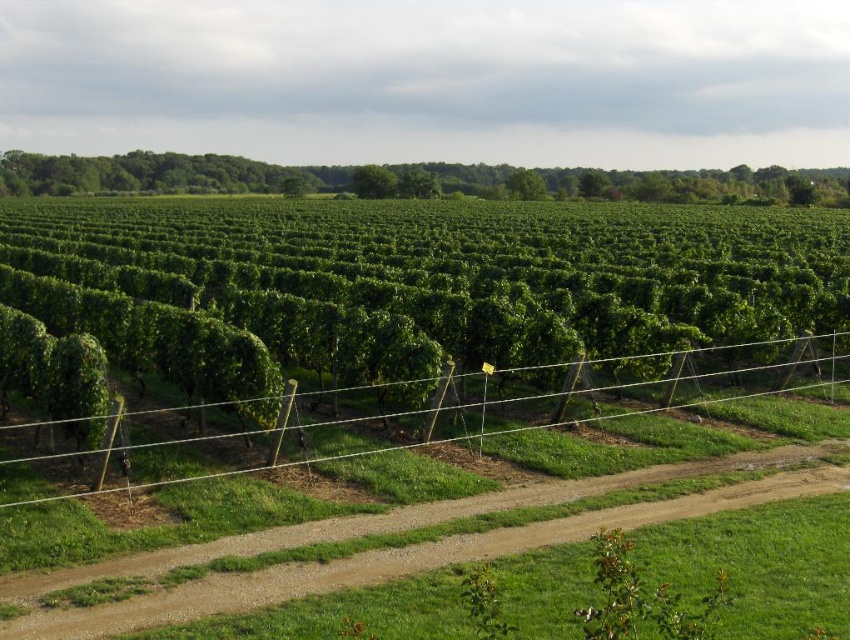
Question: Observing the image, what is the correct spatial positioning of green leafy hedge at center in reference to wire mesh fence at center?

Choices:
 (A) above
 (B) below

Answer: (A)

Question: Among these points, which one is nearest to the camera?

Choices:
 (A) (361, 166)
 (B) (718, 404)

Answer: (B)

Question: Which of the following is the farthest from the observer?

Choices:
 (A) (445, 442)
 (B) (133, 604)
 (C) (411, 337)

Answer: (C)

Question: Is brown gravel path at center smaller than wire mesh fence at center?

Choices:
 (A) no
 (B) yes

Answer: (B)

Question: Which of these objects is positioned farthest from the green leafy tree at center?

Choices:
 (A) green leafy tree at upper center
 (B) wire mesh fence at center
 (C) brown gravel path at center

Answer: (C)

Question: Does green leafy hedge at center have a smaller size compared to wire mesh fence at center?

Choices:
 (A) no
 (B) yes

Answer: (A)